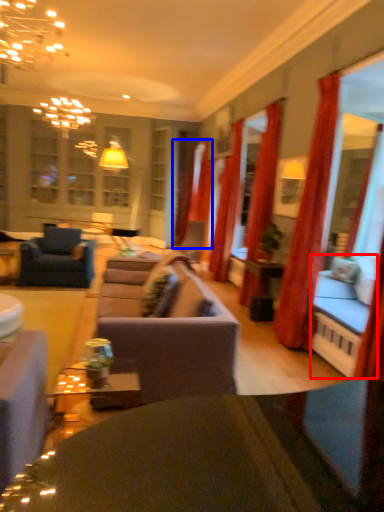
Question: Which object is closer to the camera taking this photo, couch (highlighted by a red box) or curtain (highlighted by a blue box)?

Choices:
 (A) couch
 (B) curtain

Answer: (A)